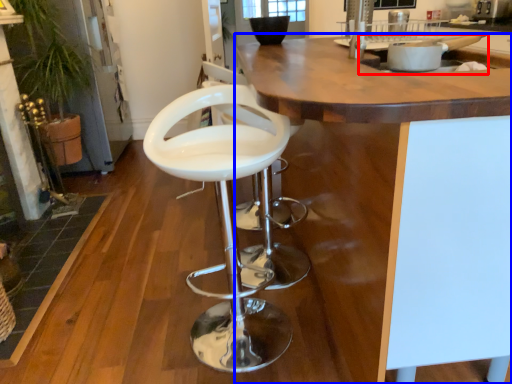
Question: Which of the following is the closest to the observer, sink (highlighted by a red box) or countertop (highlighted by a blue box)?

Choices:
 (A) sink
 (B) countertop

Answer: (B)